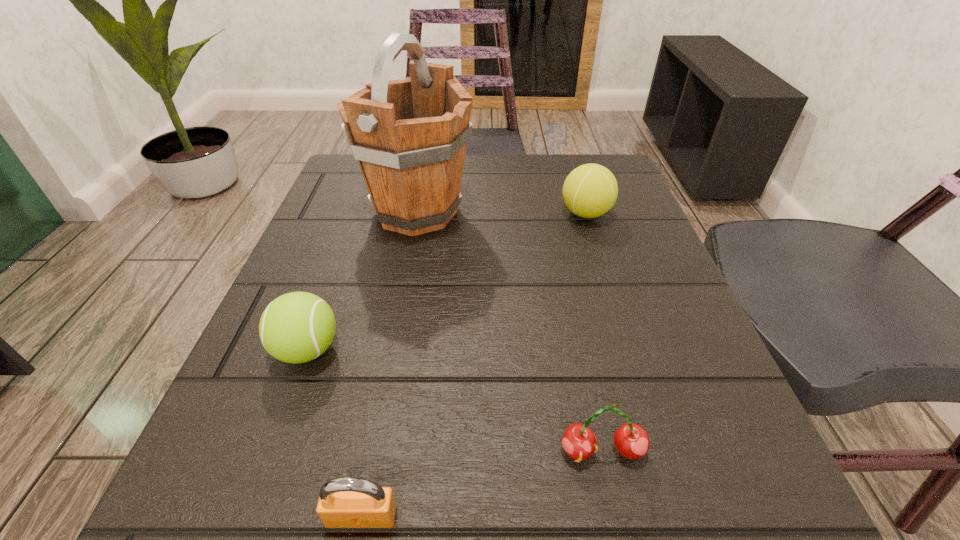
Find the location of `free area in between the right tennis ball and the nearer tennis ball`. free area in between the right tennis ball and the nearer tennis ball is located at coordinates (446, 282).

Where is `free point between the left tennis ball and the right tennis ball`? The height and width of the screenshot is (540, 960). free point between the left tennis ball and the right tennis ball is located at coordinates (446, 282).

The height and width of the screenshot is (540, 960). I want to click on unoccupied area between the padlock and the farther tennis ball, so click(x=473, y=365).

In order to click on free spot between the farther tennis ball and the padlock in this screenshot , I will do `click(473, 365)`.

Locate an element on the screen. vacant area that lies between the left tennis ball and the padlock is located at coordinates (335, 433).

At what (x,y) coordinates should I click in order to perform the action: click on free spot between the farther tennis ball and the left tennis ball. Please return your answer as a coordinate pair (x, y). This screenshot has height=540, width=960. Looking at the image, I should click on (446, 282).

The height and width of the screenshot is (540, 960). I want to click on empty space that is in between the cherry and the nearer tennis ball, so click(455, 401).

Identify the location of unoccupied position between the left tennis ball and the right tennis ball. This screenshot has width=960, height=540. (446, 282).

Locate an element on the screen. The width and height of the screenshot is (960, 540). free spot between the shortest object and the left tennis ball is located at coordinates (335, 433).

I want to click on object identified as the second closest to the nearer tennis ball, so click(409, 136).